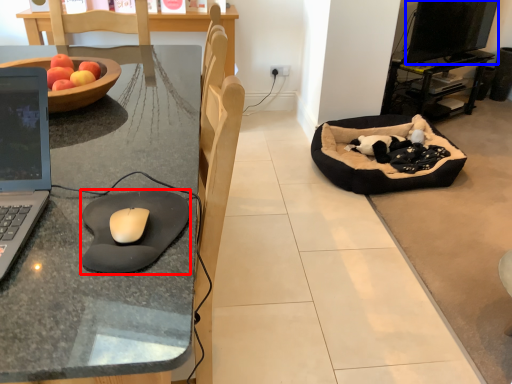
Question: Which object appears farthest to the camera in this image, mousepad (highlighted by a red box) or computer monitor (highlighted by a blue box)?

Choices:
 (A) mousepad
 (B) computer monitor

Answer: (B)